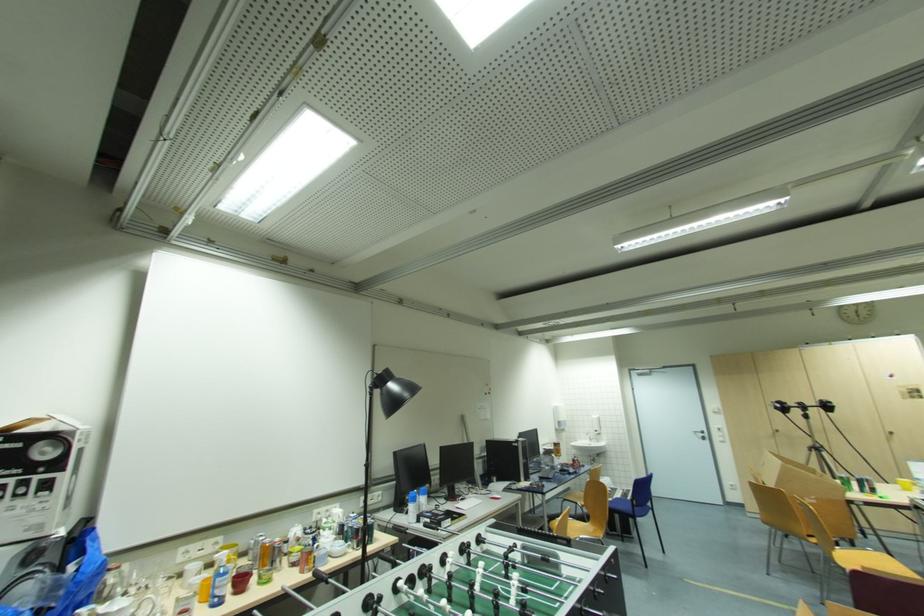
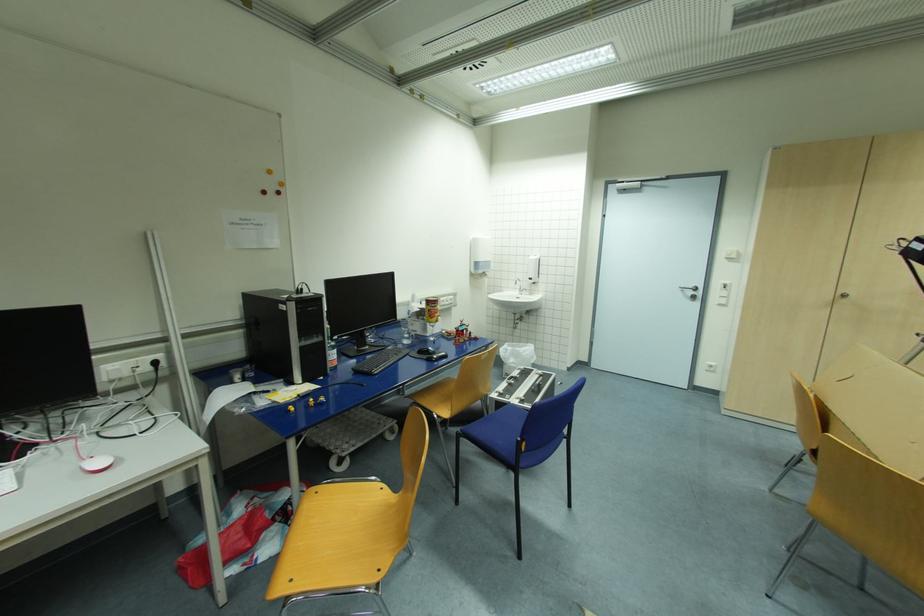
In the second image, find the point that corresponds to the point at 560,445 in the first image.

(433, 302)